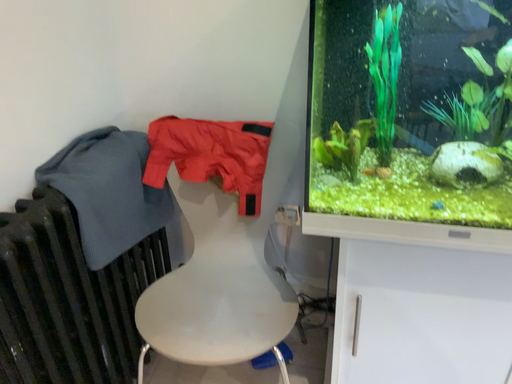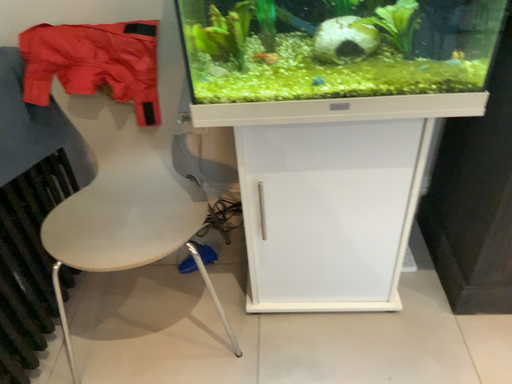
Question: Which way did the camera rotate in the video?

Choices:
 (A) rotated upward
 (B) rotated downward

Answer: (B)